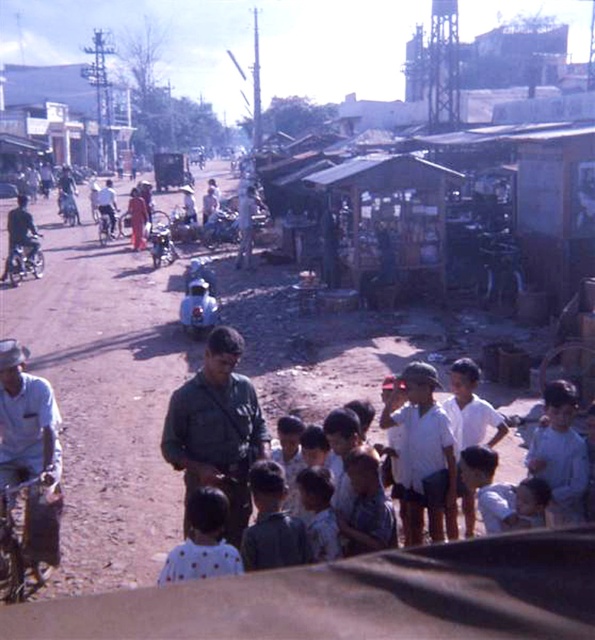
Question: Is light blue shirt at center smaller than blue matte motorcycle at left?

Choices:
 (A) yes
 (B) no

Answer: (A)

Question: Does light blue shirt at left appear over blue matte motorcycle at left?

Choices:
 (A) no
 (B) yes

Answer: (A)

Question: Among these points, which one is nearest to the camera?

Choices:
 (A) pyautogui.click(x=530, y=508)
 (B) pyautogui.click(x=280, y=552)

Answer: (B)

Question: Which object is positioned farthest from the white cotton shirt at center?

Choices:
 (A) blue matte motorcycle at left
 (B) light blue shirt at left
 (C) brown dirt field at center

Answer: (A)

Question: Can you confirm if light blue shirt at center is thinner than dark green uniform at center?

Choices:
 (A) yes
 (B) no

Answer: (A)

Question: Which object is the closest to the white cotton shirt at center?

Choices:
 (A) light blue shirt at lower center
 (B) light blue shirt at center
 (C) dark green uniform at center
 (D) light blue shirt at left

Answer: (A)